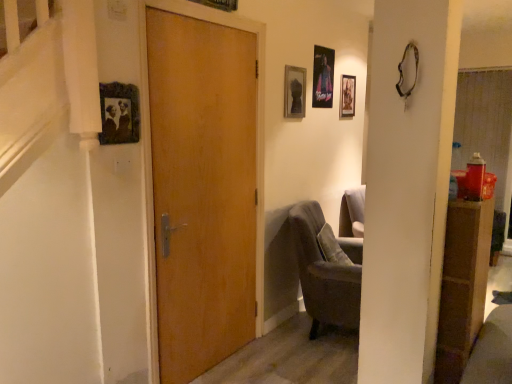
This screenshot has width=512, height=384. I want to click on matte black picture frame at upper center, marked as the 1th picture frame in a right-to-left arrangement, so click(x=347, y=96).

Describe the element at coordinates (347, 96) in the screenshot. I see `matte black picture frame at upper center, the 5th picture frame from the front` at that location.

At what (x,y) coordinates should I click in order to perform the action: click on matte glass picture frame at upper center, which appears as the third picture frame when viewed from the right. Please return your answer as a coordinate pair (x, y). The image size is (512, 384). Looking at the image, I should click on (294, 92).

What do you see at coordinates (119, 113) in the screenshot? I see `matte black picture frame at upper left, marked as the 1th picture frame in a left-to-right arrangement` at bounding box center [119, 113].

The image size is (512, 384). What do you see at coordinates (202, 190) in the screenshot?
I see `wooden door at center` at bounding box center [202, 190].

The image size is (512, 384). Describe the element at coordinates (219, 4) in the screenshot. I see `wooden picture frame at upper center, marked as the fourth picture frame in a back-to-front arrangement` at that location.

Where is `matte black picture frame at upper center, the 5th picture frame from the front`? matte black picture frame at upper center, the 5th picture frame from the front is located at coordinates (347, 96).

From a real-world perspective, is wooden picture frame at upper center, which appears as the 4th picture frame when viewed from the right, above or below metallic poster at upper center, which is the 2th picture frame from right to left?

wooden picture frame at upper center, which appears as the 4th picture frame when viewed from the right, is above metallic poster at upper center, which is the 2th picture frame from right to left.

Considering their positions, is wooden picture frame at upper center, the 2th picture frame in the front-to-back sequence, located in front of or behind metallic poster at upper center, which appears as the 4th picture frame when viewed from the left?

Clearly, wooden picture frame at upper center, the 2th picture frame in the front-to-back sequence, is in front of metallic poster at upper center, which appears as the 4th picture frame when viewed from the left.

Is wooden picture frame at upper center, the 2th picture frame in the front-to-back sequence, wider or thinner than metallic poster at upper center, acting as the fourth picture frame starting from the front?

In the image, wooden picture frame at upper center, the 2th picture frame in the front-to-back sequence, appears to be wider than metallic poster at upper center, acting as the fourth picture frame starting from the front.

Considering the sizes of objects wooden picture frame at upper center, which appears as the 4th picture frame when viewed from the right, and metallic poster at upper center, acting as the fourth picture frame starting from the front, in the image provided, who is taller, wooden picture frame at upper center, which appears as the 4th picture frame when viewed from the right, or metallic poster at upper center, acting as the fourth picture frame starting from the front,?

metallic poster at upper center, acting as the fourth picture frame starting from the front.

Is matte black picture frame at upper center, the 5th picture frame from the front, inside the boundaries of wooden door at center, or outside?

matte black picture frame at upper center, the 5th picture frame from the front, is not enclosed by wooden door at center.

From a real-world perspective, relative to wooden door at center, is matte black picture frame at upper center, which is the first picture frame from back to front, vertically above or below?

From a real-world perspective, matte black picture frame at upper center, which is the first picture frame from back to front, is physically above wooden door at center.

Between matte black picture frame at upper center, marked as the 1th picture frame in a right-to-left arrangement, and wooden door at center, which one has more height?

wooden door at center.

In the scene shown: Which is less distant, (349,87) or (156,43)?

Clearly, point (349,87) is more distant from the camera than point (156,43).

From the image's perspective, which is above, metallic poster at upper center, which is the second picture frame in back-to-front order, or matte black picture frame at upper left, arranged as the 1th picture frame when viewed from the front?

metallic poster at upper center, which is the second picture frame in back-to-front order.

Considering the relative sizes of metallic poster at upper center, which is the second picture frame in back-to-front order, and matte black picture frame at upper left, the 5th picture frame in the right-to-left sequence, in the image provided, is metallic poster at upper center, which is the second picture frame in back-to-front order, bigger than matte black picture frame at upper left, the 5th picture frame in the right-to-left sequence,?

Indeed, metallic poster at upper center, which is the second picture frame in back-to-front order, has a larger size compared to matte black picture frame at upper left, the 5th picture frame in the right-to-left sequence.

Is metallic poster at upper center, which is the second picture frame in back-to-front order, shorter than matte black picture frame at upper left, the 5th picture frame in the right-to-left sequence?

Incorrect, the height of metallic poster at upper center, which is the second picture frame in back-to-front order, does not fall short of that of matte black picture frame at upper left, the 5th picture frame in the right-to-left sequence.

Looking at this image, would you consider metallic poster at upper center, which is the second picture frame in back-to-front order, to be distant from wooden picture frame at upper center, the 2th picture frame in the front-to-back sequence?

metallic poster at upper center, which is the second picture frame in back-to-front order, is far away from wooden picture frame at upper center, the 2th picture frame in the front-to-back sequence.

Considering the sizes of objects metallic poster at upper center, which appears as the 4th picture frame when viewed from the left, and wooden picture frame at upper center, which appears as the 4th picture frame when viewed from the right, in the image provided, who is taller, metallic poster at upper center, which appears as the 4th picture frame when viewed from the left, or wooden picture frame at upper center, which appears as the 4th picture frame when viewed from the right,?

metallic poster at upper center, which appears as the 4th picture frame when viewed from the left.

Is metallic poster at upper center, acting as the fourth picture frame starting from the front, oriented away from wooden picture frame at upper center, marked as the 2th picture frame in a left-to-right arrangement?

That's not correct — metallic poster at upper center, acting as the fourth picture frame starting from the front, is not looking away from wooden picture frame at upper center, marked as the 2th picture frame in a left-to-right arrangement.

Does velvet grey armchair at lower right appear on the left side of matte glass picture frame at upper center, which appears as the 3th picture frame when viewed from the back?

No, velvet grey armchair at lower right is not to the left of matte glass picture frame at upper center, which appears as the 3th picture frame when viewed from the back.

Based on the photo, is the position of velvet grey armchair at lower right more distant than that of matte glass picture frame at upper center, which appears as the third picture frame when viewed from the right?

No, it is not.

Choose the correct answer: Is velvet grey armchair at lower right inside matte glass picture frame at upper center, which is counted as the third picture frame, starting from the front, or outside it?

velvet grey armchair at lower right is spatially situated outside matte glass picture frame at upper center, which is counted as the third picture frame, starting from the front.

From a real-world perspective, is velvet grey armchair at lower right physically below matte glass picture frame at upper center, which appears as the 3th picture frame when viewed from the back?

Yes, from a real-world perspective, velvet grey armchair at lower right is below matte glass picture frame at upper center, which appears as the 3th picture frame when viewed from the back.

Image resolution: width=512 pixels, height=384 pixels. What are the coordinates of `picture frame that is the 2nd one above the matte black picture frame at upper center, the 5th picture frame from the front (from a real-world perspective)` in the screenshot? It's located at (323, 77).

Can you see matte black picture frame at upper center, which is the first picture frame from back to front, touching metallic poster at upper center, which is the second picture frame in back-to-front order?

matte black picture frame at upper center, which is the first picture frame from back to front, is not next to metallic poster at upper center, which is the second picture frame in back-to-front order, and they're not touching.

Is matte black picture frame at upper center, the fifth picture frame in the left-to-right sequence, closer to the viewer compared to metallic poster at upper center, which appears as the 4th picture frame when viewed from the left?

No, it is behind metallic poster at upper center, which appears as the 4th picture frame when viewed from the left.

Considering the positions of points (344, 86) and (329, 51), is point (344, 86) farther from camera compared to point (329, 51)?

Yes, it is behind point (329, 51).

From a real-world perspective, is matte glass picture frame at upper center, which is counted as the third picture frame, starting from the front, positioned under matte black picture frame at upper center, which is the first picture frame from back to front, based on gravity?

No, from a real-world perspective, matte glass picture frame at upper center, which is counted as the third picture frame, starting from the front, is not under matte black picture frame at upper center, which is the first picture frame from back to front.

Which is behind, point (285, 65) or point (346, 98)?

The point (346, 98) is more distant.

Is matte glass picture frame at upper center, arranged as the 3th picture frame when viewed from the left, to the right of matte black picture frame at upper center, which is the first picture frame from back to front, from the viewer's perspective?

In fact, matte glass picture frame at upper center, arranged as the 3th picture frame when viewed from the left, is to the left of matte black picture frame at upper center, which is the first picture frame from back to front.

Is matte glass picture frame at upper center, which appears as the third picture frame when viewed from the right, bigger or smaller than matte black picture frame at upper center, the 5th picture frame from the front?

Clearly, matte glass picture frame at upper center, which appears as the third picture frame when viewed from the right, is larger in size than matte black picture frame at upper center, the 5th picture frame from the front.

Identify the location of picture frame above the metallic poster at upper center, which appears as the 4th picture frame when viewed from the left (from a real-world perspective). The image size is (512, 384). [x=219, y=4].

Locate an element on the screen. This screenshot has width=512, height=384. door below the matte black picture frame at upper center, which is the first picture frame from back to front (from a real-world perspective) is located at coordinates point(202,190).

Looking at this image, estimate the real-world distances between objects in this image. Which object is closer to metallic poster at upper center, which appears as the 4th picture frame when viewed from the left, velvet grey armchair at lower right or wooden picture frame at upper center, marked as the 2th picture frame in a left-to-right arrangement?

wooden picture frame at upper center, marked as the 2th picture frame in a left-to-right arrangement.

Considering their positions, is matte glass picture frame at upper center, which appears as the third picture frame when viewed from the right, positioned further to velvet grey armchair at lower right than metallic poster at upper center, which is the 2th picture frame from right to left?

metallic poster at upper center, which is the 2th picture frame from right to left, is further to velvet grey armchair at lower right.

From the image, which object appears to be nearer to wooden picture frame at upper center, marked as the fourth picture frame in a back-to-front arrangement, matte glass picture frame at upper center, which appears as the third picture frame when viewed from the right, or matte black picture frame at upper center, which is the first picture frame from back to front?

matte glass picture frame at upper center, which appears as the third picture frame when viewed from the right, is positioned closer to the anchor wooden picture frame at upper center, marked as the fourth picture frame in a back-to-front arrangement.

Based on their spatial positions, is wooden door at center or matte black picture frame at upper left, marked as the 1th picture frame in a left-to-right arrangement, closer to metallic poster at upper center, acting as the fourth picture frame starting from the front?

Among the two, wooden door at center is located nearer to metallic poster at upper center, acting as the fourth picture frame starting from the front.

Considering their positions, is matte black picture frame at upper left, the 5th picture frame in the right-to-left sequence, positioned further to matte glass picture frame at upper center, which appears as the third picture frame when viewed from the right, than wooden door at center?

matte black picture frame at upper left, the 5th picture frame in the right-to-left sequence, lies further to matte glass picture frame at upper center, which appears as the third picture frame when viewed from the right, than the other object.

Looking at the image, which one is located further to wooden picture frame at upper center, which appears as the 4th picture frame when viewed from the right, metallic poster at upper center, which appears as the 4th picture frame when viewed from the left, or matte black picture frame at upper center, which is the first picture frame from back to front?

matte black picture frame at upper center, which is the first picture frame from back to front, lies further to wooden picture frame at upper center, which appears as the 4th picture frame when viewed from the right, than the other object.

Which object lies further to the anchor point velvet grey armchair at lower right, matte black picture frame at upper left, marked as the 1th picture frame in a left-to-right arrangement, or metallic poster at upper center, which is the second picture frame in back-to-front order?

Among the two, matte black picture frame at upper left, marked as the 1th picture frame in a left-to-right arrangement, is located further to velvet grey armchair at lower right.

From the image, which object appears to be nearer to wooden picture frame at upper center, the 2th picture frame in the front-to-back sequence, velvet grey armchair at lower right or wooden door at center?

The object closer to wooden picture frame at upper center, the 2th picture frame in the front-to-back sequence, is wooden door at center.

Where is `door between matte black picture frame at upper left, marked as the 1th picture frame in a left-to-right arrangement, and metallic poster at upper center, which appears as the 4th picture frame when viewed from the left, from front to back`? The image size is (512, 384). door between matte black picture frame at upper left, marked as the 1th picture frame in a left-to-right arrangement, and metallic poster at upper center, which appears as the 4th picture frame when viewed from the left, from front to back is located at coordinates (202, 190).

At what (x,y) coordinates should I click in order to perform the action: click on door between matte glass picture frame at upper center, which appears as the third picture frame when viewed from the right, and velvet grey armchair at lower right from top to bottom. Please return your answer as a coordinate pair (x, y). Looking at the image, I should click on (202, 190).

Locate an element on the screen. chair between wooden door at center and matte black picture frame at upper center, the 5th picture frame from the front, in the front-back direction is located at coordinates (325, 272).

The width and height of the screenshot is (512, 384). I want to click on chair between matte black picture frame at upper left, the 5th picture frame in the right-to-left sequence, and matte black picture frame at upper center, the 5th picture frame from the front, in the front-back direction, so click(325, 272).